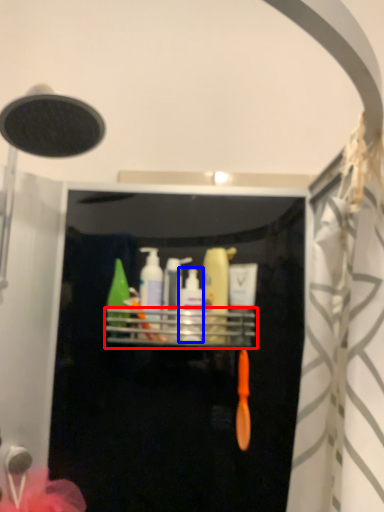
Question: Which object appears farthest to the camera in this image, shelf (highlighted by a red box) or toiletry (highlighted by a blue box)?

Choices:
 (A) shelf
 (B) toiletry

Answer: (B)